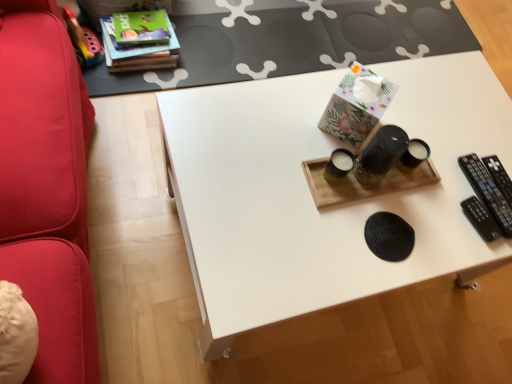
Locate an element on the screen. free space to the left of black plastic remote at right is located at coordinates (424, 173).